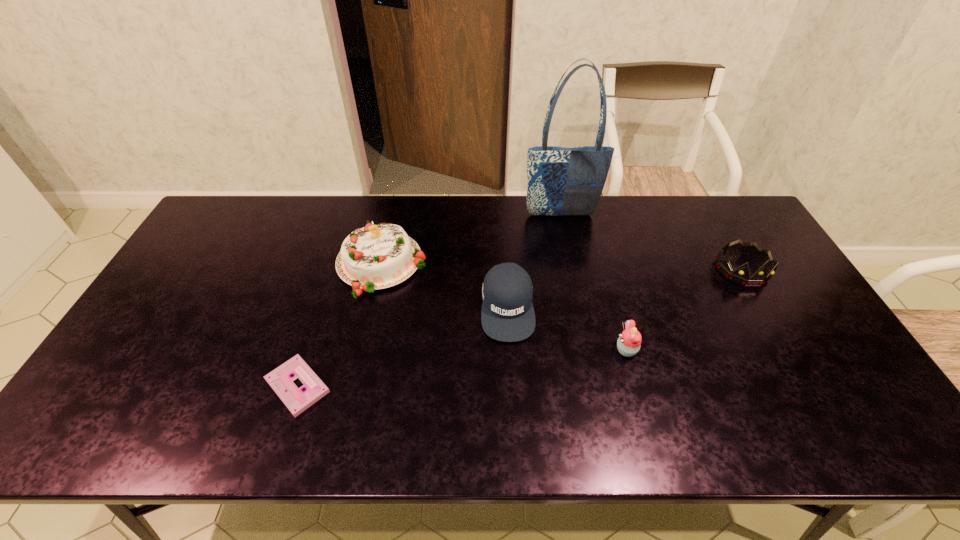
You are a GUI agent. You are given a task and a screenshot of the screen. Output one action in this format:
    pyautogui.click(x=<x>, y=<y>)
    Task: Click on the vacant space positioned 0.050m on the front-facing side of the baseball cap
    This screenshot has width=960, height=540.
    Given the screenshot: What is the action you would take?
    pyautogui.click(x=511, y=360)

Find the location of `vacant space located 0.190m on the face of the cupcake`. vacant space located 0.190m on the face of the cupcake is located at coordinates (542, 350).

Where is `vacant space positioned on the face of the cupcake`? The image size is (960, 540). vacant space positioned on the face of the cupcake is located at coordinates (569, 350).

Image resolution: width=960 pixels, height=540 pixels. I want to click on vacant area situated on the face of the cupcake, so click(x=592, y=350).

What are the coordinates of `blank area located 0.360m on the right of the videotape` in the screenshot? It's located at (479, 386).

Locate an element on the screen. The image size is (960, 540). shopping bag that is positioned at the far edge is located at coordinates (562, 181).

What are the coordinates of `cake that is positioned at the far edge` in the screenshot? It's located at (380, 256).

The height and width of the screenshot is (540, 960). I want to click on object located at the near edge, so click(x=281, y=379).

In order to click on object at the right edge in this screenshot , I will do `click(740, 275)`.

In the image, there is a desktop. In order to click on free space at the far edge in this screenshot , I will do `click(490, 200)`.